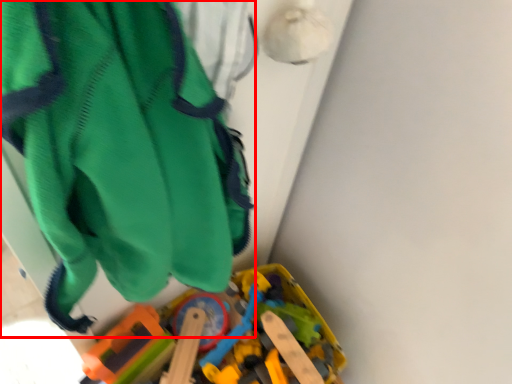
Question: From the image's perspective, considering the relative positions of wide (annotated by the red box) and toy in the image provided, where is wide (annotated by the red box) located with respect to the staircase?

Choices:
 (A) below
 (B) above

Answer: (B)